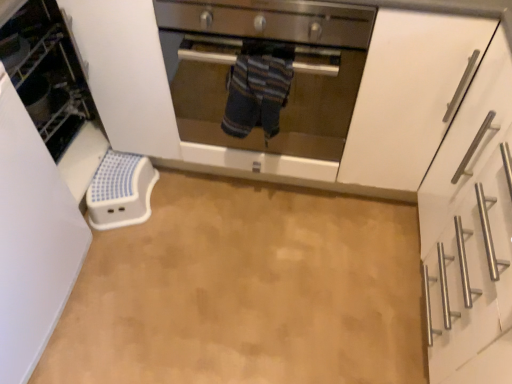
Question: Is white plastic step stool at left shorter than white matte cabinet at right?

Choices:
 (A) no
 (B) yes

Answer: (A)

Question: Does white plastic step stool at left turn towards white matte cabinet at right?

Choices:
 (A) yes
 (B) no

Answer: (B)

Question: Would you consider white plastic step stool at left to be distant from white matte cabinet at right?

Choices:
 (A) no
 (B) yes

Answer: (B)

Question: Considering the relative sizes of white plastic step stool at left and white matte cabinet at right in the image provided, is white plastic step stool at left thinner than white matte cabinet at right?

Choices:
 (A) no
 (B) yes

Answer: (B)

Question: Is white plastic step stool at left to the left of white matte cabinet at right from the viewer's perspective?

Choices:
 (A) yes
 (B) no

Answer: (A)

Question: Does white plastic step stool at left appear on the right side of white matte cabinet at right?

Choices:
 (A) no
 (B) yes

Answer: (A)

Question: From the image's perspective, is stainless steel oven at center below beige vinyl floor at center?

Choices:
 (A) yes
 (B) no

Answer: (B)

Question: Is stainless steel oven at center surrounding beige vinyl floor at center?

Choices:
 (A) yes
 (B) no

Answer: (B)

Question: From a real-world perspective, is stainless steel oven at center physically below beige vinyl floor at center?

Choices:
 (A) no
 (B) yes

Answer: (A)

Question: Is stainless steel oven at center wider than beige vinyl floor at center?

Choices:
 (A) no
 (B) yes

Answer: (A)

Question: Is stainless steel oven at center positioned far away from beige vinyl floor at center?

Choices:
 (A) yes
 (B) no

Answer: (B)

Question: Is stainless steel oven at center shorter than beige vinyl floor at center?

Choices:
 (A) no
 (B) yes

Answer: (A)

Question: Considering the relative positions of white matte cabinet at right and stainless steel oven at center in the image provided, is white matte cabinet at right behind stainless steel oven at center?

Choices:
 (A) no
 (B) yes

Answer: (A)